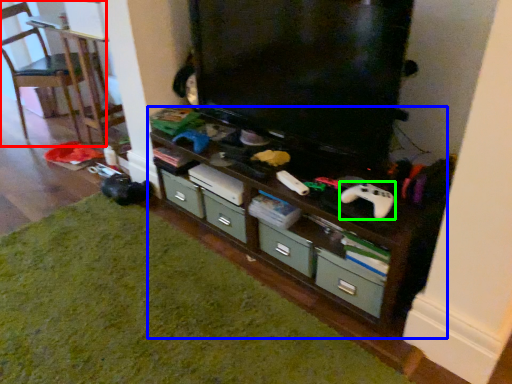
Question: Considering the real-world distances, which object is farthest from chair (highlighted by a red box)? shelf (highlighted by a blue box) or game controller (highlighted by a green box)?

Choices:
 (A) shelf
 (B) game controller

Answer: (B)